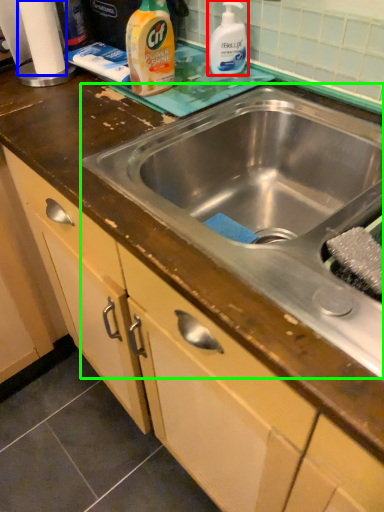
Question: Estimate the real-world distances between objects in this image. Which object is closer to cleaning product (highlighted by a red box), toilet paper (highlighted by a blue box) or sink (highlighted by a green box)?

Choices:
 (A) toilet paper
 (B) sink

Answer: (B)